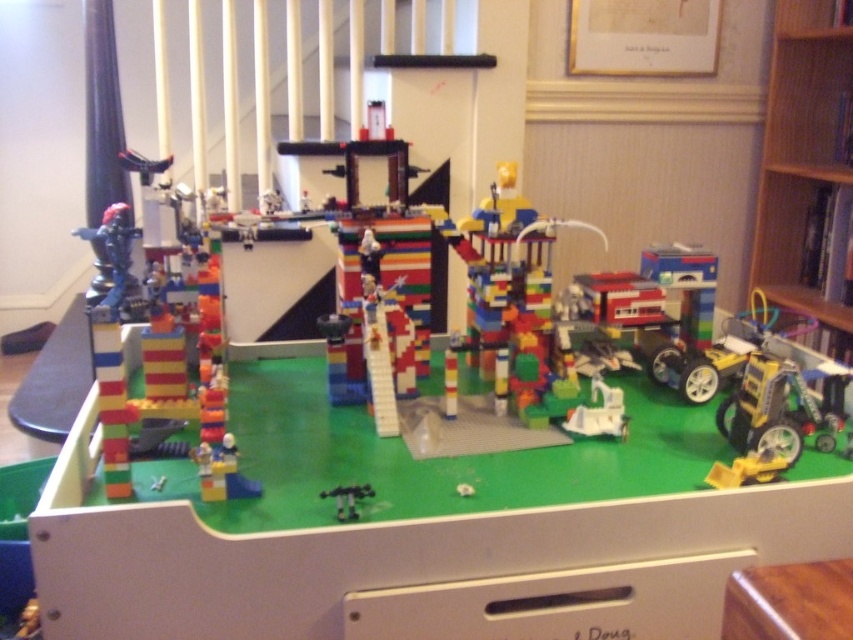
Between point (850, 340) and point (335, 486), which one is positioned behind?

Point (850, 340)

Describe the element at coordinates (808, 170) in the screenshot. This screenshot has width=853, height=640. I see `wooden bookshelf at right` at that location.

Is point (782, 52) less distant than point (341, 492)?

No, it is not.

Identify the location of wooden bookshelf at right. This screenshot has width=853, height=640. (808, 170).